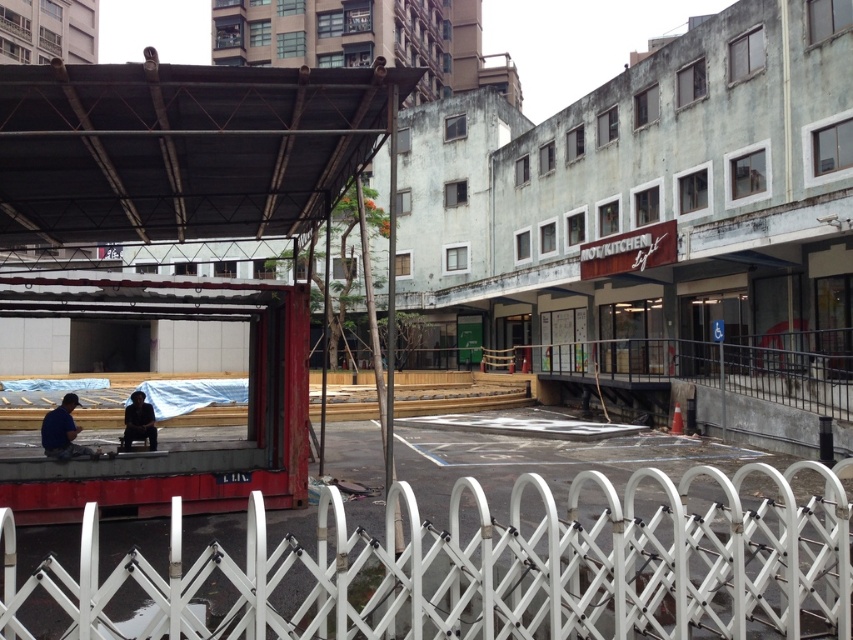
You are a delivery person trying to reach the construction site entrance located to the right of the white plastic fence at lower center. You are currently standing near the dark blue shirt at center. Which direction should you move to reach the entrance?

The white plastic fence at lower center is to the right of the dark blue shirt at center, so you should move to the right to reach the entrance located to the right of the white plastic fence at lower center.

You are a delivery person trying to stay dry during a sudden rain shower. You see a black metal canopy at upper left and a blue fabric man at lower left. Which object can provide shelter from the rain?

The black metal canopy at upper left is positioned over blue fabric man at lower left, so the black metal canopy at upper left can provide shelter from the rain.

What are the coordinates of the black metal canopy at upper left in the image?

The coordinates of the black metal canopy at upper left are at point (183, 147).